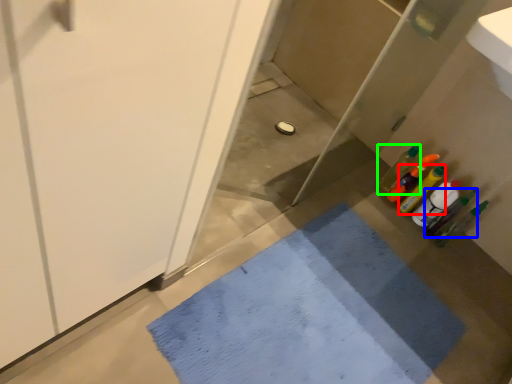
Question: Based on their relative distances, which object is farther from bottle (highlighted by a red box)? Choose from bottle (highlighted by a blue box) and bottle (highlighted by a green box).

Choices:
 (A) bottle
 (B) bottle

Answer: (A)